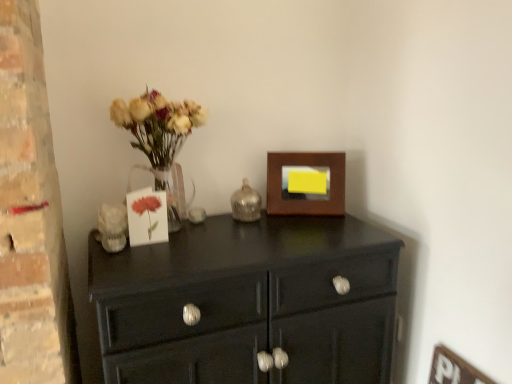
Question: Is matte glass vase with dried flowers at left looking in the opposite direction of glossy black cabinet at center?

Choices:
 (A) no
 (B) yes

Answer: (A)

Question: Can you confirm if matte glass vase with dried flowers at left is smaller than glossy black cabinet at center?

Choices:
 (A) no
 (B) yes

Answer: (B)

Question: Considering the relative sizes of matte glass vase with dried flowers at left and glossy black cabinet at center in the image provided, is matte glass vase with dried flowers at left wider than glossy black cabinet at center?

Choices:
 (A) no
 (B) yes

Answer: (A)

Question: Can you confirm if matte glass vase with dried flowers at left is taller than glossy black cabinet at center?

Choices:
 (A) no
 (B) yes

Answer: (A)

Question: Is matte glass vase with dried flowers at left at the right side of glossy black cabinet at center?

Choices:
 (A) yes
 (B) no

Answer: (B)

Question: Is matte glass vase with dried flowers at left positioned in front of glossy black cabinet at center?

Choices:
 (A) no
 (B) yes

Answer: (A)

Question: Is shiny metallic candle holder at center closer to camera compared to wooden picture frame at upper right?

Choices:
 (A) yes
 (B) no

Answer: (A)

Question: Is shiny metallic candle holder at center aimed at wooden picture frame at upper right?

Choices:
 (A) no
 (B) yes

Answer: (A)

Question: From the image's perspective, does shiny metallic candle holder at center appear higher than wooden picture frame at upper right?

Choices:
 (A) yes
 (B) no

Answer: (B)

Question: Does shiny metallic candle holder at center have a greater height compared to wooden picture frame at upper right?

Choices:
 (A) no
 (B) yes

Answer: (A)

Question: From a real-world perspective, is shiny metallic candle holder at center positioned over wooden picture frame at upper right based on gravity?

Choices:
 (A) yes
 (B) no

Answer: (B)

Question: Is shiny metallic candle holder at center to the right of wooden picture frame at upper right from the viewer's perspective?

Choices:
 (A) yes
 (B) no

Answer: (B)

Question: Can shiny metallic candle holder at center be found inside glossy black cabinet at center?

Choices:
 (A) yes
 (B) no

Answer: (B)